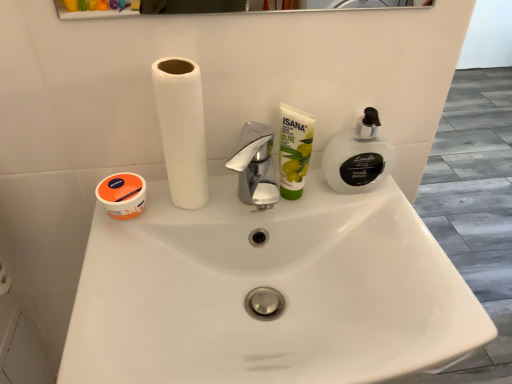
Describe the element at coordinates (122, 195) in the screenshot. The image size is (512, 384). I see `orange matte cream at left` at that location.

Image resolution: width=512 pixels, height=384 pixels. What do you see at coordinates (268, 292) in the screenshot?
I see `white glossy sink at center` at bounding box center [268, 292].

Locate an element on the screen. white matte paper towel at center is located at coordinates (182, 129).

Can you confirm if white matte paper towel at center is smaller than white glossy sink at center?

Correct, white matte paper towel at center occupies less space than white glossy sink at center.

Considering the sizes of objects white matte paper towel at center and white glossy sink at center in the image provided, who is shorter, white matte paper towel at center or white glossy sink at center?

Answer: With less height is white glossy sink at center.

Does point (181, 59) come closer to viewer compared to point (94, 361)?

No, it is not.

Is white matte paper towel at center oriented towards white glossy sink at center?

No, white matte paper towel at center is not turned towards white glossy sink at center.

Is white glossy sink at center next to white matte paper towel at center and touching it?

white glossy sink at center and white matte paper towel at center are clearly separated.

Considering the sizes of objects white glossy sink at center and white matte paper towel at center in the image provided, who is taller, white glossy sink at center or white matte paper towel at center?

With more height is white matte paper towel at center.

Which object is thinner, white glossy sink at center or white matte paper towel at center?

white matte paper towel at center.

Does point (161, 198) come closer to viewer compared to point (190, 160)?

No, it is behind (190, 160).

Can green matte olive oil cream at center be found inside white translucent pump at right?

Actually, green matte olive oil cream at center is outside white translucent pump at right.

Is point (351, 145) in front of point (312, 137)?

No, it is not.

From the image's perspective, is white translucent pump at right beneath green matte olive oil cream at center?

Actually, white translucent pump at right appears above green matte olive oil cream at center in the image.

Which object is closer to the camera, white translucent pump at right or green matte olive oil cream at center?

green matte olive oil cream at center.

Is white translucent pump at right turned away from white glossy sink at center?

No, white glossy sink at center is not at the back of white translucent pump at right.

Considering the relative positions of white translucent pump at right and white glossy sink at center in the image provided, is white translucent pump at right to the left of white glossy sink at center from the viewer's perspective?

Incorrect, white translucent pump at right is not on the left side of white glossy sink at center.

From the image's perspective, who appears lower, white translucent pump at right or white glossy sink at center?

From the image's view, white glossy sink at center is below.

Can you confirm if green matte olive oil cream at center is smaller than white translucent pump at right?

Correct, green matte olive oil cream at center occupies less space than white translucent pump at right.

Which object is closer to the camera taking this photo, green matte olive oil cream at center or white translucent pump at right?

green matte olive oil cream at center is more forward.

Which is closer, (x=287, y=117) or (x=351, y=169)?

The point (x=287, y=117) is closer.

From the image's perspective, is green matte olive oil cream at center located above white translucent pump at right?

No, from the image's perspective, green matte olive oil cream at center is not over white translucent pump at right.

Which of these two, white glossy sink at center or green matte olive oil cream at center, stands taller?

green matte olive oil cream at center.

From the picture: Is white glossy sink at center next to green matte olive oil cream at center?

white glossy sink at center and green matte olive oil cream at center are clearly separated.

From a real-world perspective, is white glossy sink at center below green matte olive oil cream at center?

Yes, from a real-world perspective, white glossy sink at center is beneath green matte olive oil cream at center.

From the picture: Between white glossy sink at center and white translucent pump at right, which one has less height?

Standing shorter between the two is white glossy sink at center.

Is white glossy sink at center turned away from white translucent pump at right?

No, white glossy sink at center is not facing the opposite direction of white translucent pump at right.

Is white glossy sink at center in front of white translucent pump at right?

Yes, it is in front of white translucent pump at right.

Between point (256, 333) and point (382, 173), which one is positioned in front?

The point (256, 333) is more forward.

Locate an element on the screen. This screenshot has height=384, width=512. paper towel lying on the left of white glossy sink at center is located at coordinates (182, 129).

This screenshot has width=512, height=384. In order to click on sink to the right of white matte paper towel at center in this screenshot , I will do `click(268, 292)`.

Looking at the image, which one is located further to white translucent pump at right, orange matte cream at left or white glossy sink at center?

orange matte cream at left is positioned further to the anchor white translucent pump at right.

Estimate the real-world distances between objects in this image. Which object is closer to white glossy sink at center, white translucent pump at right or white matte paper towel at center?

Among the two, white matte paper towel at center is located nearer to white glossy sink at center.

When comparing their distances from orange matte cream at left, does white matte paper towel at center or white translucent pump at right seem further?

white translucent pump at right is positioned further to the anchor orange matte cream at left.

Which object lies nearer to the anchor point white glossy sink at center, white matte paper towel at center or white translucent pump at right?

white matte paper towel at center.

When comparing their distances from white translucent pump at right, does white matte paper towel at center or orange matte cream at left seem further?

orange matte cream at left.

In the scene shown: Considering their positions, is orange matte cream at left positioned closer to white matte paper towel at center than white translucent pump at right?

The object closer to white matte paper towel at center is orange matte cream at left.

When comparing their distances from orange matte cream at left, does white matte paper towel at center or white glossy sink at center seem closer?

The object closer to orange matte cream at left is white matte paper towel at center.

Which object lies nearer to the anchor point green matte olive oil cream at center, white translucent pump at right or orange matte cream at left?

white translucent pump at right lies closer to green matte olive oil cream at center than the other object.

This screenshot has height=384, width=512. I want to click on sink between orange matte cream at left and green matte olive oil cream at center, so click(268, 292).

I want to click on product located between white matte paper towel at center and white translucent pump at right in the left-right direction, so tap(294, 150).

You are a GUI agent. You are given a task and a screenshot of the screen. Output one action in this format:
    pyautogui.click(x=<x>, y=<y>)
    Task: Click on the product between white matte paper towel at center and white glossy sink at center in the up-down direction
    This screenshot has height=384, width=512.
    Given the screenshot: What is the action you would take?
    pyautogui.click(x=294, y=150)

What are the coordinates of `paper towel between orange matte cream at left and white translucent pump at right` in the screenshot? It's located at (182, 129).